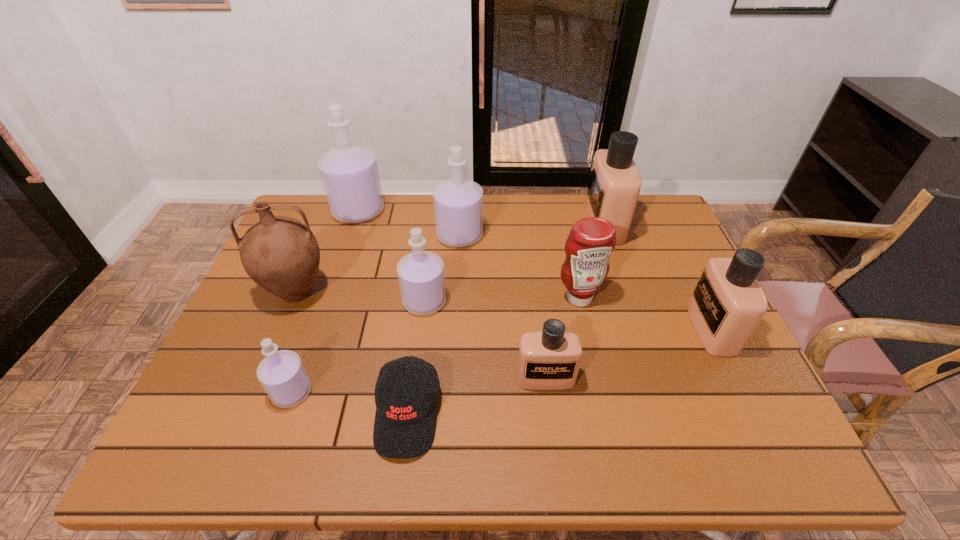
Identify which beige perfume is the second nearest to the third biggest purple perfume. Please provide its 2D coordinates. Your answer should be formatted as a tuple, i.e. [(x, y)], where the tuple contains the x and y coordinates of a point satisfying the conditions above.

[(615, 182)]

Where is `vacant area that satisfies the following two spatial constraints: 1. on the back side of the tallest object; 2. on the right side of the brown pitcher`? This screenshot has width=960, height=540. vacant area that satisfies the following two spatial constraints: 1. on the back side of the tallest object; 2. on the right side of the brown pitcher is located at coordinates (331, 211).

Locate an element on the screen. The width and height of the screenshot is (960, 540). free space that satisfies the following two spatial constraints: 1. on the front label of the sixth perfume from left to right; 2. on the front side of the smallest purple perfume is located at coordinates [x=660, y=392].

Locate an element on the screen. free region that satisfies the following two spatial constraints: 1. on the front label of the sixth perfume from left to right; 2. on the front-facing side of the baseball cap is located at coordinates (667, 414).

The height and width of the screenshot is (540, 960). What are the coordinates of `free location that satisfies the following two spatial constraints: 1. on the front side of the third smallest purple perfume; 2. on the right side of the tallest object` in the screenshot? It's located at (350, 235).